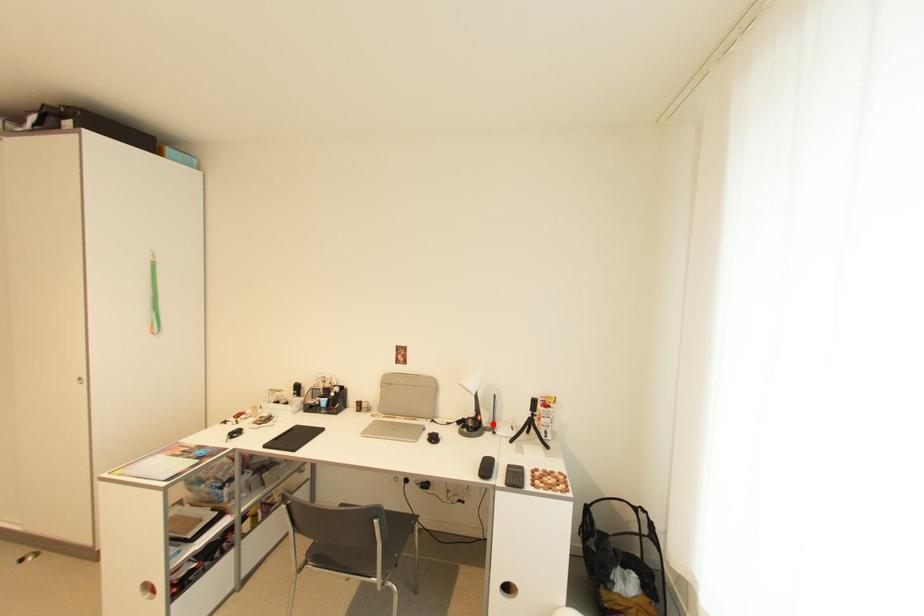
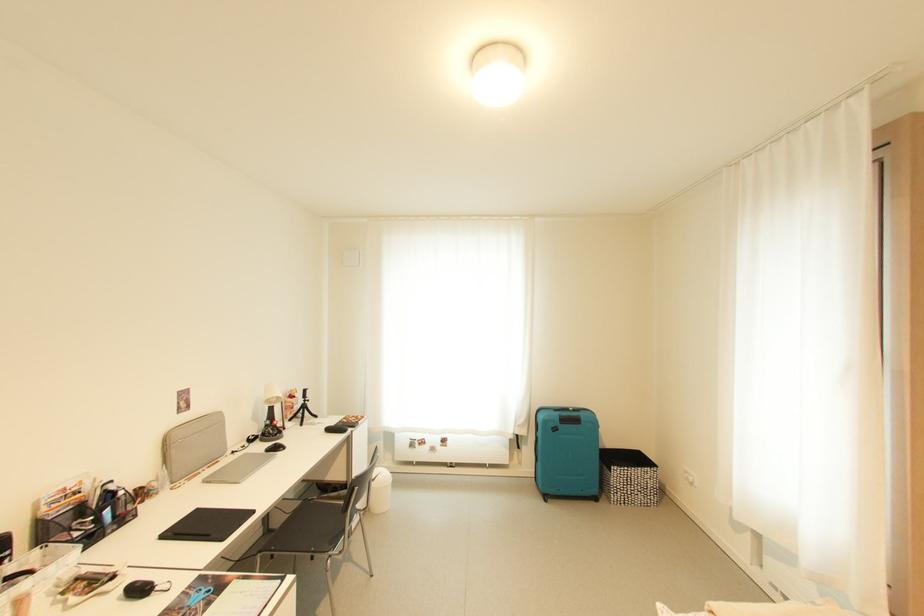
In the second image, find the point that corresponds to the highlighted location in the first image.

(262, 434)